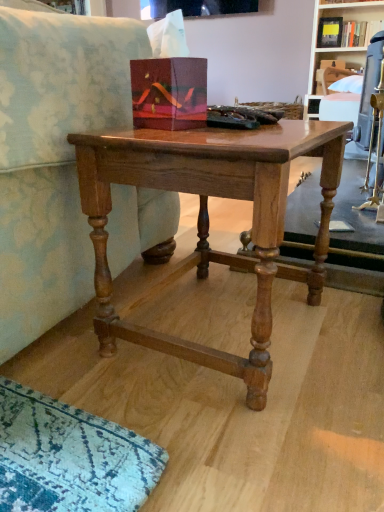
Locate an element on the screen. wooden bookshelf at upper right, which is the first shelf from top to bottom is located at coordinates (338, 47).

At what (x,y) coordinates should I click in order to perform the action: click on wooden bookshelf at upper right, placed as the second shelf when sorted from bottom to top. Please return your answer as a coordinate pair (x, y). Image resolution: width=384 pixels, height=512 pixels. Looking at the image, I should click on (338, 47).

Is wooden shelf at upper right, marked as the 1th shelf in a bottom-to-top arrangement, inside the boundaries of shiny brown wood table at center, or outside?

wooden shelf at upper right, marked as the 1th shelf in a bottom-to-top arrangement, is outside shiny brown wood table at center.

From the image's perspective, between wooden shelf at upper right, positioned as the 2th shelf in top-to-bottom order, and shiny brown wood table at center, which one is located above?

wooden shelf at upper right, positioned as the 2th shelf in top-to-bottom order, is shown above in the image.

In the scene shown: Does wooden shelf at upper right, marked as the 1th shelf in a bottom-to-top arrangement, turn towards shiny brown wood table at center?

No, wooden shelf at upper right, marked as the 1th shelf in a bottom-to-top arrangement, is not turned towards shiny brown wood table at center.

Is wooden shelf at upper right, positioned as the 2th shelf in top-to-bottom order, wider than shiny brown wood table at center?

Correct, the width of wooden shelf at upper right, positioned as the 2th shelf in top-to-bottom order, exceeds that of shiny brown wood table at center.

How many degrees apart are the facing directions of wooden shelf at upper right, marked as the 1th shelf in a bottom-to-top arrangement, and wooden bookshelf at upper right, which is the first shelf from top to bottom?

The angular difference between wooden shelf at upper right, marked as the 1th shelf in a bottom-to-top arrangement, and wooden bookshelf at upper right, which is the first shelf from top to bottom, is 1.42 degrees.

Is wooden shelf at upper right, positioned as the 2th shelf in top-to-bottom order, taller than wooden bookshelf at upper right, placed as the second shelf when sorted from bottom to top?

In fact, wooden shelf at upper right, positioned as the 2th shelf in top-to-bottom order, may be shorter than wooden bookshelf at upper right, placed as the second shelf when sorted from bottom to top.

Which is behind, point (309, 87) or point (381, 4)?

The point (309, 87) is farther from the camera.

Based on the photo, can you confirm if wooden shelf at upper right, marked as the 1th shelf in a bottom-to-top arrangement, is thinner than wooden bookshelf at upper right, placed as the second shelf when sorted from bottom to top?

Yes, wooden shelf at upper right, marked as the 1th shelf in a bottom-to-top arrangement, is thinner than wooden bookshelf at upper right, placed as the second shelf when sorted from bottom to top.

In the scene shown: From a real-world perspective, which object stands above the other?

In real-world perspective, wooden bookshelf at upper right, placed as the second shelf when sorted from bottom to top, is above.

From the picture: Is wooden bookshelf at upper right, placed as the second shelf when sorted from bottom to top, a part of shiny brown wood table at center?

No, wooden bookshelf at upper right, placed as the second shelf when sorted from bottom to top, is not a part of shiny brown wood table at center.

How different are the orientations of shiny brown wood table at center and wooden bookshelf at upper right, which is the first shelf from top to bottom, in degrees?

The facing directions of shiny brown wood table at center and wooden bookshelf at upper right, which is the first shelf from top to bottom, are 42.7 degrees apart.

Does shiny brown wood table at center have a smaller size compared to wooden bookshelf at upper right, which is the first shelf from top to bottom?

Indeed, shiny brown wood table at center has a smaller size compared to wooden bookshelf at upper right, which is the first shelf from top to bottom.

From a real-world perspective, which is physically above, wooden bookshelf at upper right, placed as the second shelf when sorted from bottom to top, or shiny brown wood table at center?

From a 3D spatial view, wooden bookshelf at upper right, placed as the second shelf when sorted from bottom to top, is above.

Is wooden bookshelf at upper right, placed as the second shelf when sorted from bottom to top, in contact with shiny brown wood table at center?

They are not placed beside each other.

Is wooden bookshelf at upper right, which is the first shelf from top to bottom, facing towards shiny brown wood table at center?

No, wooden bookshelf at upper right, which is the first shelf from top to bottom, does not turn towards shiny brown wood table at center.

Which is correct: wooden bookshelf at upper right, placed as the second shelf when sorted from bottom to top, is inside shiny brown wood table at center, or outside of it?

The correct answer is: outside.

Do you think wooden bookshelf at upper right, which is the first shelf from top to bottom, is within wooden shelf at upper right, positioned as the 2th shelf in top-to-bottom order, or outside of it?

wooden bookshelf at upper right, which is the first shelf from top to bottom, fits inside wooden shelf at upper right, positioned as the 2th shelf in top-to-bottom order.

Considering the relative positions of wooden bookshelf at upper right, placed as the second shelf when sorted from bottom to top, and wooden shelf at upper right, positioned as the 2th shelf in top-to-bottom order, in the image provided, is wooden bookshelf at upper right, placed as the second shelf when sorted from bottom to top, to the right of wooden shelf at upper right, positioned as the 2th shelf in top-to-bottom order, from the viewer's perspective?

Indeed, wooden bookshelf at upper right, placed as the second shelf when sorted from bottom to top, is positioned on the right side of wooden shelf at upper right, positioned as the 2th shelf in top-to-bottom order.

Considering the relative sizes of wooden bookshelf at upper right, placed as the second shelf when sorted from bottom to top, and wooden shelf at upper right, positioned as the 2th shelf in top-to-bottom order, in the image provided, is wooden bookshelf at upper right, placed as the second shelf when sorted from bottom to top, taller than wooden shelf at upper right, positioned as the 2th shelf in top-to-bottom order,?

Correct, wooden bookshelf at upper right, placed as the second shelf when sorted from bottom to top, is much taller as wooden shelf at upper right, positioned as the 2th shelf in top-to-bottom order.

Could you tell me if shiny brown wood table at center is facing wooden shelf at upper right, positioned as the 2th shelf in top-to-bottom order?

No.

Between point (261, 243) and point (342, 66), which one is positioned in front?

The point (261, 243) is closer to the camera.

From a real-world perspective, who is located lower, shiny brown wood table at center or wooden shelf at upper right, marked as the 1th shelf in a bottom-to-top arrangement?

shiny brown wood table at center, from a real-world perspective.

At what (x,y) coordinates should I click in order to perform the action: click on desk directly beneath the wooden shelf at upper right, marked as the 1th shelf in a bottom-to-top arrangement (from a real-world perspective). Please return your answer as a coordinate pair (x, y). Image resolution: width=384 pixels, height=512 pixels. Looking at the image, I should click on (208, 219).

Image resolution: width=384 pixels, height=512 pixels. In order to click on shelf lying on the right of wooden shelf at upper right, marked as the 1th shelf in a bottom-to-top arrangement in this screenshot , I will do `click(338, 47)`.

From the image, which object appears to be farther from wooden bookshelf at upper right, which is the first shelf from top to bottom, shiny brown wood table at center or wooden shelf at upper right, marked as the 1th shelf in a bottom-to-top arrangement?

shiny brown wood table at center is positioned further to the anchor wooden bookshelf at upper right, which is the first shelf from top to bottom.

Looking at this image, based on their spatial positions, is wooden shelf at upper right, positioned as the 2th shelf in top-to-bottom order, or shiny brown wood table at center closer to wooden bookshelf at upper right, placed as the second shelf when sorted from bottom to top?

wooden shelf at upper right, positioned as the 2th shelf in top-to-bottom order, lies closer to wooden bookshelf at upper right, placed as the second shelf when sorted from bottom to top, than the other object.

When comparing their distances from shiny brown wood table at center, does wooden shelf at upper right, marked as the 1th shelf in a bottom-to-top arrangement, or wooden bookshelf at upper right, which is the first shelf from top to bottom, seem further?

wooden shelf at upper right, marked as the 1th shelf in a bottom-to-top arrangement, is positioned further to the anchor shiny brown wood table at center.

Considering their positions, is shiny brown wood table at center positioned closer to wooden shelf at upper right, positioned as the 2th shelf in top-to-bottom order, than wooden bookshelf at upper right, placed as the second shelf when sorted from bottom to top?

wooden bookshelf at upper right, placed as the second shelf when sorted from bottom to top, is positioned closer to the anchor wooden shelf at upper right, positioned as the 2th shelf in top-to-bottom order.

Looking at the image, which one is located further to shiny brown wood table at center, wooden bookshelf at upper right, which is the first shelf from top to bottom, or wooden shelf at upper right, marked as the 1th shelf in a bottom-to-top arrangement?

wooden shelf at upper right, marked as the 1th shelf in a bottom-to-top arrangement, lies further to shiny brown wood table at center than the other object.

Which object lies nearer to the anchor point wooden shelf at upper right, positioned as the 2th shelf in top-to-bottom order, wooden bookshelf at upper right, placed as the second shelf when sorted from bottom to top, or shiny brown wood table at center?

wooden bookshelf at upper right, placed as the second shelf when sorted from bottom to top, lies closer to wooden shelf at upper right, positioned as the 2th shelf in top-to-bottom order, than the other object.

In order to click on shelf between shiny brown wood table at center and wooden shelf at upper right, marked as the 1th shelf in a bottom-to-top arrangement, from front to back in this screenshot , I will do `click(338, 47)`.